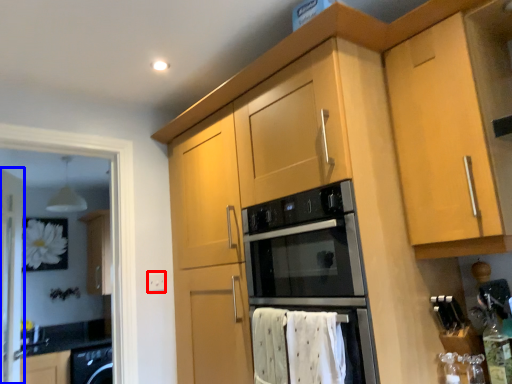
Question: Which object appears closest to the camera in this image, electric outlet (highlighted by a red box) or screen door (highlighted by a blue box)?

Choices:
 (A) electric outlet
 (B) screen door

Answer: (B)